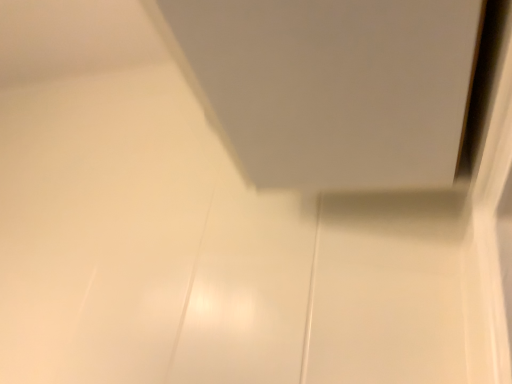
Describe the element at coordinates (330, 86) in the screenshot. I see `white matte exhaust hood at upper center` at that location.

Image resolution: width=512 pixels, height=384 pixels. Identify the location of white matte exhaust hood at upper center. (330, 86).

Where is `white matte exhaust hood at upper center`? The image size is (512, 384). white matte exhaust hood at upper center is located at coordinates (330, 86).